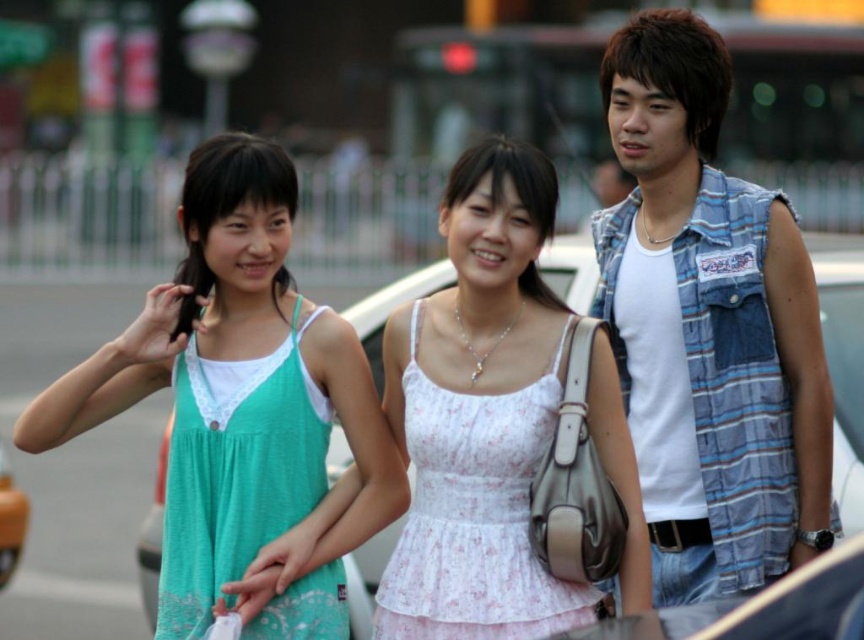
You are a photographer setting up a photo shoot for a fashion magazine. You have two dresses to feature in the shoot, the teal fabric dress at left and the white floral dress at center. The magazine requires that the dress taking up more space should be placed in the foreground to emphasize its design. Based on the scene description, which dress should be positioned in the foreground?

The white floral dress at center should be positioned in the foreground because it occupies more space than the teal fabric dress at left, allowing its design to be emphasized as required by the magazine.

You are a photographer trying to capture a photo of the white floral dress at center and the white fabric car at center. Which object should you focus on first if you want to include both in the frame without needing to adjust your camera angle?

The white floral dress at center has a lesser height compared to the white fabric car at center, so you should focus on the taller white fabric car at center first to ensure it fits within the frame.

You are taking a photo of two points in the scene. The first point is at coordinate point (289, 224) and the second is at point (850, 337). If you want to focus on the point that is closer to the camera, which coordinate should you choose?

You should choose point (289, 224) because it is closer to the camera than point (850, 337).